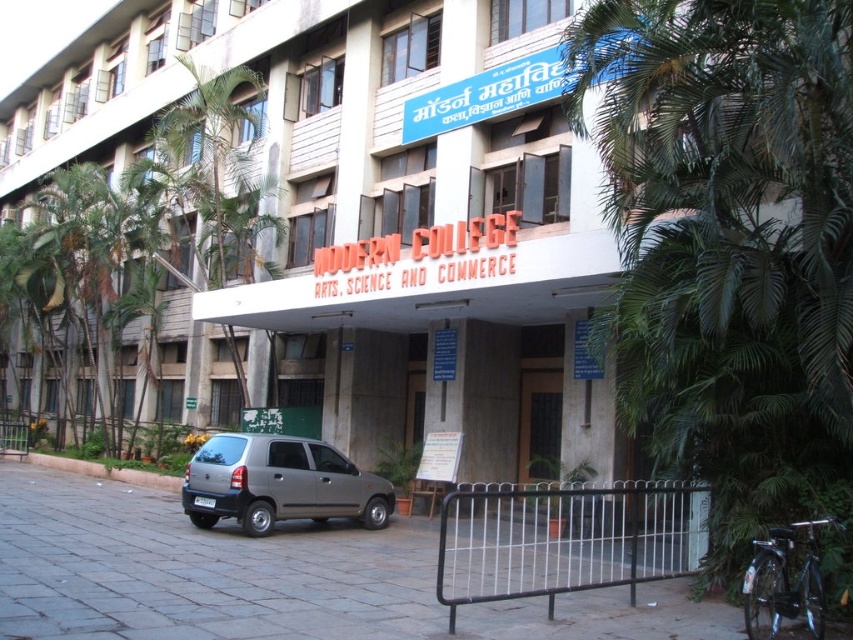
Question: Is green leafy palm tree at upper left wider than brown wooden door at center?

Choices:
 (A) no
 (B) yes

Answer: (A)

Question: Among these objects, which one is nearest to the camera?

Choices:
 (A) green leafy palm tree at upper left
 (B) brown wooden door at center
 (C) satin silver car at lower left

Answer: (C)

Question: Does green leafy palm tree at upper left appear under satin silver car at lower left?

Choices:
 (A) yes
 (B) no

Answer: (B)

Question: Which point is closer to the camera?

Choices:
 (A) satin silver car at lower left
 (B) brown wooden door at center

Answer: (A)

Question: In this image, where is green leafy palm tree at upper left located relative to satin silver car at lower left?

Choices:
 (A) below
 (B) above

Answer: (B)

Question: Which object appears farthest from the camera in this image?

Choices:
 (A) satin silver car at lower left
 (B) green leafy palm tree at upper left
 (C) brown wooden door at center

Answer: (B)